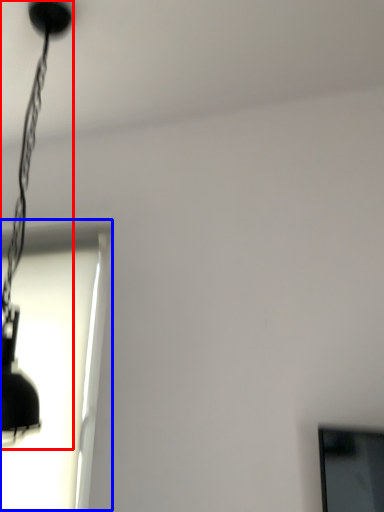
Question: Which object is closer to the camera taking this photo, lamp (highlighted by a red box) or window (highlighted by a blue box)?

Choices:
 (A) lamp
 (B) window

Answer: (A)